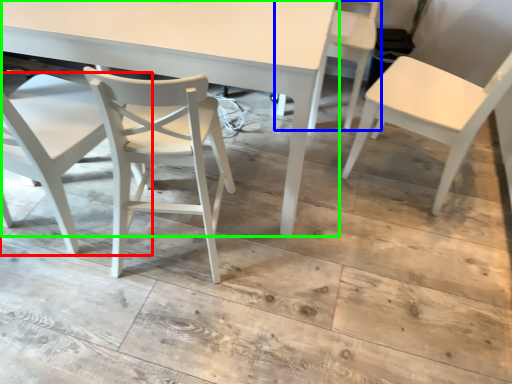
Question: Based on their relative distances, which object is farther from chair (highlighted by a red box)? Choose from chair (highlighted by a blue box) and table (highlighted by a green box).

Choices:
 (A) chair
 (B) table

Answer: (A)